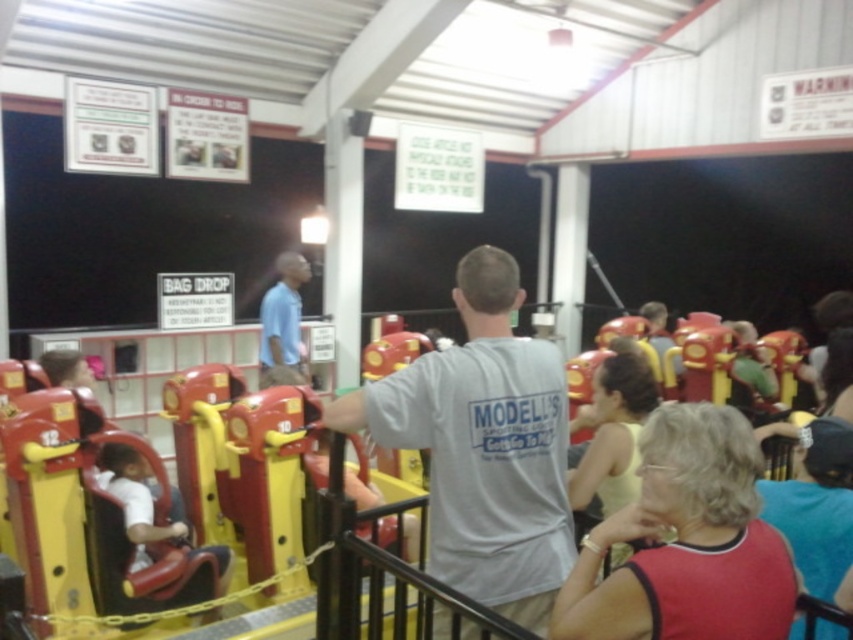
You are standing at the center of the amusement park and see a point marked at coordinates (686, 541). Which object is this point located on?

The point at coordinates (686, 541) is located on the red fabric shirt at lower right.

You are standing at the entrance of the amusement park and see two people in the scene wearing a red fabric shirt at lower right and a light blue shirt at center. Which person is positioned lower in the image?

The red fabric shirt at lower right is positioned below the light blue shirt at center, so the person wearing the red fabric shirt at lower right is lower in the image.